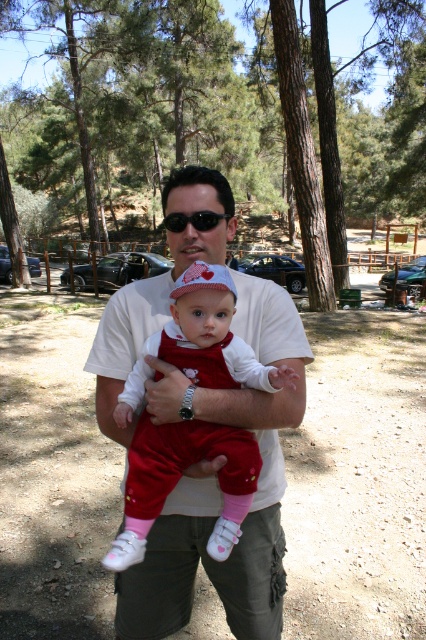
You are a photographer setting up a shot of the man and the baby in the red onesie. You need to place a prop at point (180, 477). What object will be under the prop?

The matte red onesie at center is located at point (180, 477), so placing the prop there would place it directly on top of the matte red onesie at center.

You are a photographer trying to capture a closeup shot of the matte red onesie at center and the white matte skin at center. Your camera has a depth of field that can focus on objects within 10 inches. Will both subjects be in focus?

The distance between the matte red onesie at center and white matte skin at center is 10.63 inches, which exceeds the camera depth of field of 10 inches. Therefore, both subjects cannot be in focus simultaneously.